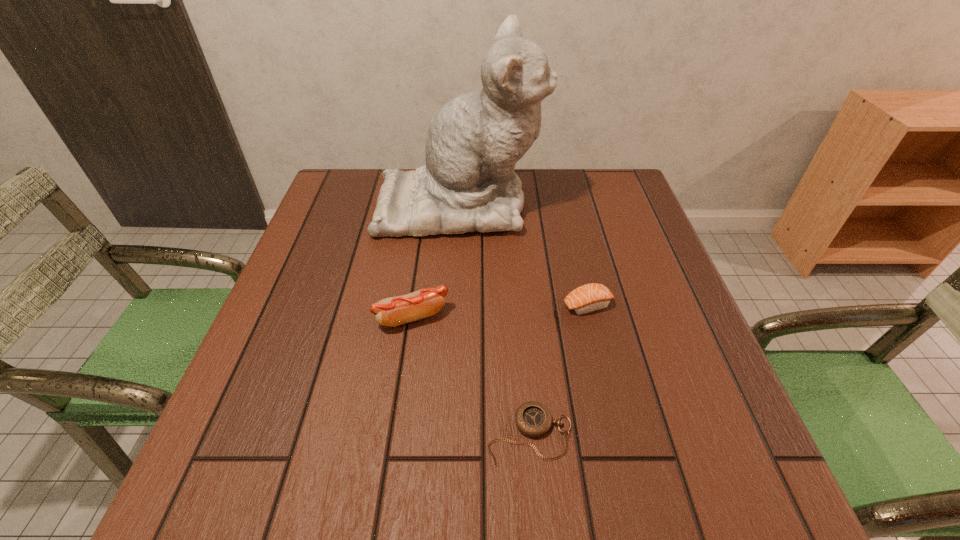
At what (x,y) coordinates should I click in order to perform the action: click on vacant region that satisfies the following two spatial constraints: 1. on the back side of the sushi; 2. on the front-facing side of the tallest object. Please return your answer as a coordinate pair (x, y). The height and width of the screenshot is (540, 960). Looking at the image, I should click on (564, 203).

The width and height of the screenshot is (960, 540). Find the location of `free region that satisfies the following two spatial constraints: 1. on the front-facing side of the farthest object; 2. on the back side of the sushi`. free region that satisfies the following two spatial constraints: 1. on the front-facing side of the farthest object; 2. on the back side of the sushi is located at coordinates (454, 305).